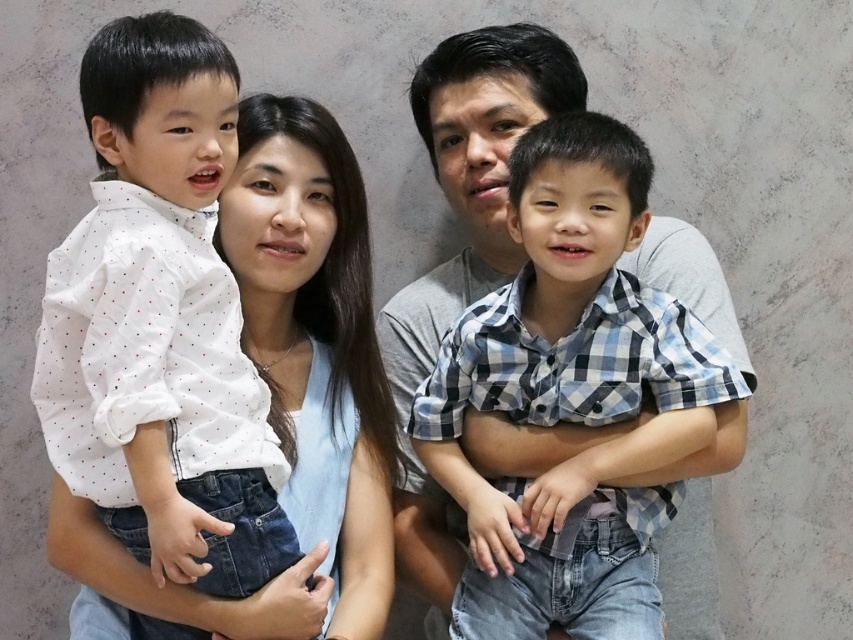
Who is positioned more to the left, checkered fabric shirt at center or matte white shirt at left?

matte white shirt at left

Which is behind, point (454, 364) or point (335, 552)?

The point (335, 552) is more distant.

Where is `checkered fabric shirt at center`? The height and width of the screenshot is (640, 853). checkered fabric shirt at center is located at coordinates (572, 396).